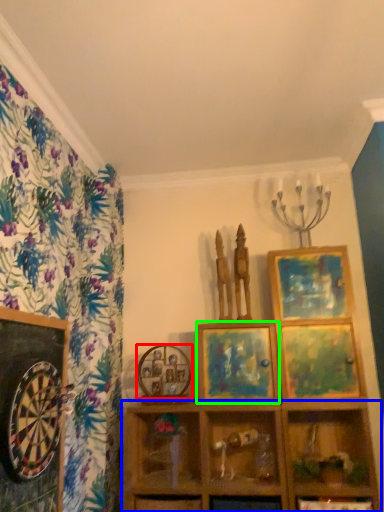
Question: Which is farther away from picture frame (highlighted by a red box)? shelf (highlighted by a blue box) or picture frame (highlighted by a green box)?

Choices:
 (A) shelf
 (B) picture frame

Answer: (A)